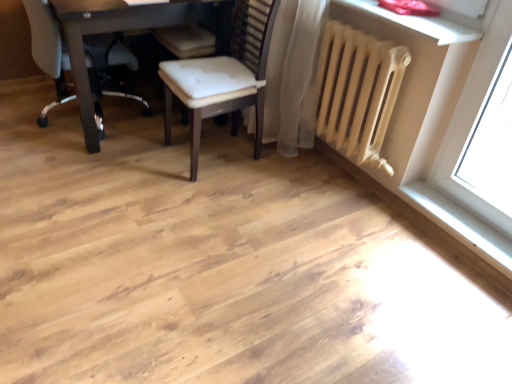
Question: Visually, is white smooth window sill at lower right positioned to the left or to the right of beige matte radiator at upper right?

Choices:
 (A) right
 (B) left

Answer: (A)

Question: Considering the positions of white smooth window sill at lower right and beige matte radiator at upper right in the image, is white smooth window sill at lower right taller or shorter than beige matte radiator at upper right?

Choices:
 (A) short
 (B) tall

Answer: (A)

Question: Estimate the real-world distances between objects in this image. Which object is farther from the matte dark brown table at upper left?

Choices:
 (A) wooden chair at center, the 1th chair in the right-to-left sequence
 (B) beige matte radiator at upper right
 (C) white smooth window sill at lower right
 (D) white leather chair at upper left, acting as the 2th chair starting from the right

Answer: (C)

Question: Which is nearer to the beige matte radiator at upper right?

Choices:
 (A) wooden chair at center, the 1th chair in the right-to-left sequence
 (B) matte dark brown table at upper left
 (C) white smooth window sill at lower right
 (D) white leather chair at upper left, the 1th chair in the left-to-right sequence

Answer: (A)